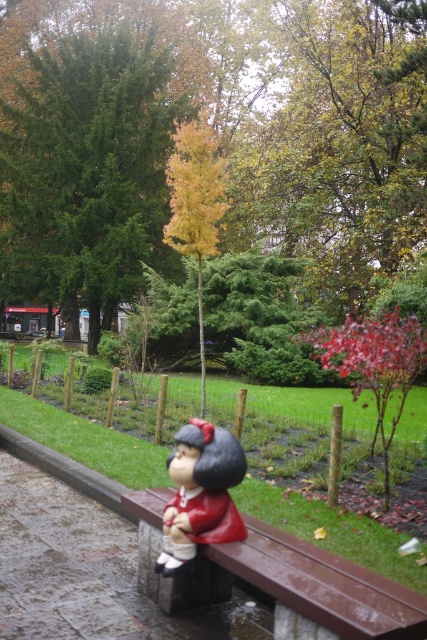
Question: Estimate the real-world distances between objects in this image. Which object is farther from the yellow-green foliage at center?

Choices:
 (A) matte red doll at center
 (B) matte red statue at center

Answer: (B)

Question: Does brown metallic bench at lower center appear over yellow-green foliage at center?

Choices:
 (A) no
 (B) yes

Answer: (A)

Question: Does brown metallic bench at lower center have a smaller size compared to smooth red bark tree at center?

Choices:
 (A) yes
 (B) no

Answer: (A)

Question: Which point is closer to the camera?

Choices:
 (A) (415, 618)
 (B) (237, 536)
 (C) (318, 330)
 (D) (154, 200)

Answer: (A)

Question: Does brown metallic bench at lower center appear on the right side of smooth red bark tree at center?

Choices:
 (A) yes
 (B) no

Answer: (B)

Question: Which point is closer to the camera?

Choices:
 (A) (265, 540)
 (B) (210, 426)
 (C) (414, 323)
 (D) (359, 205)

Answer: (B)